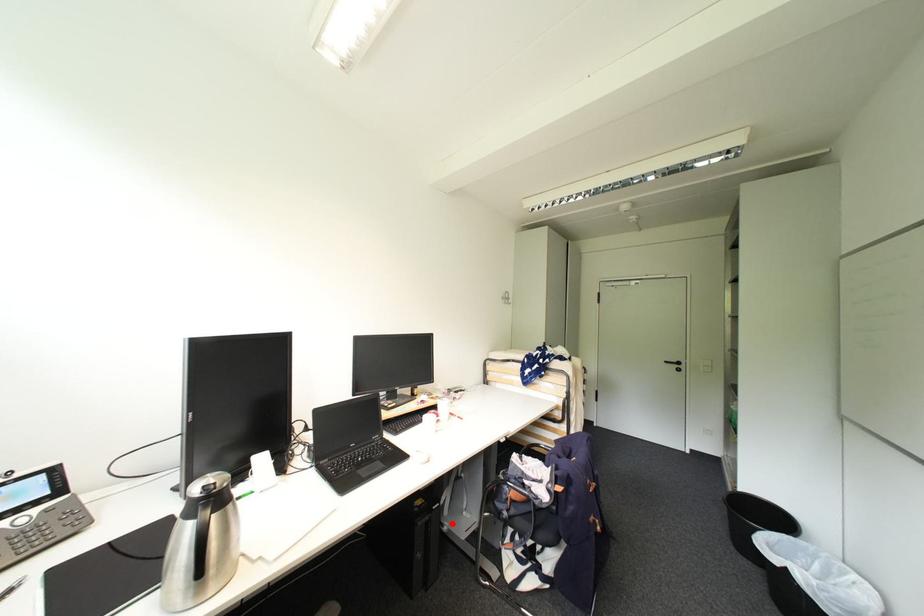
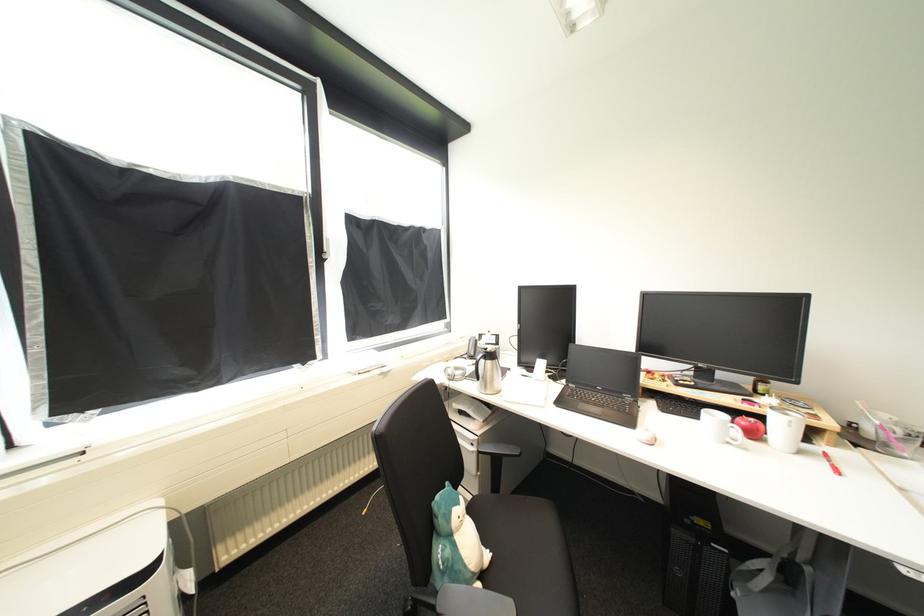
Where in the second image is the point corresponding to the highlighted location from the first image?

(745, 591)